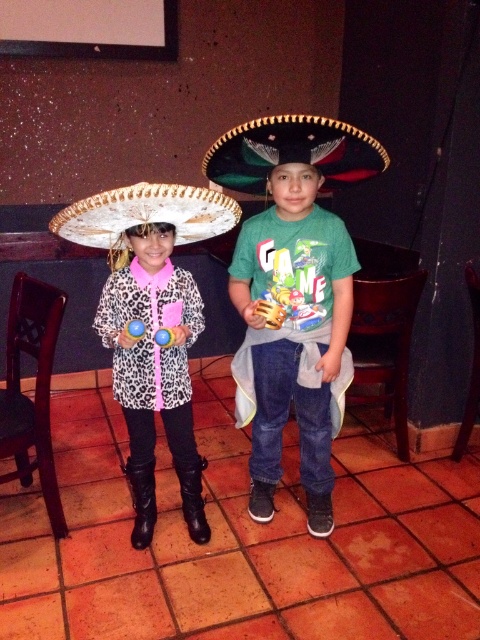
You are a photographer trying to capture a clear shot of both the leopard print jacket at center and the white felt sombrero at left. However, the sombrero is blocking the jacket. Can you adjust your position to see the jacket without moving the objects?

The leopard print jacket at center is positioned under the white felt sombrero at left, so moving your camera position lower might allow you to see the jacket without obstruction.

Consider the image. You are navigating a small robot through an indoor space. The robot needs to move from point A to point B. Point A is at coordinates point (349, 276) and point B is at coordinates point (228, 196). Given the scene description, which direction should the robot move to reach point B from point A?

The robot should move backward to reach point B from point A because point (349, 276) is in front of point (228, 196).

You are a photographer at the event and need to arrange the two children so that the leopard print coat at center and the white felt sombrero at left are visible in the frame. Which child should be positioned to the left to ensure both items are in the photo?

The child wearing the white felt sombrero at left should be positioned to the left. Since the leopard print coat at center is on the right side of the white felt sombrero at left, placing the sombrero wearer on the left ensures both items are visible in the frame.